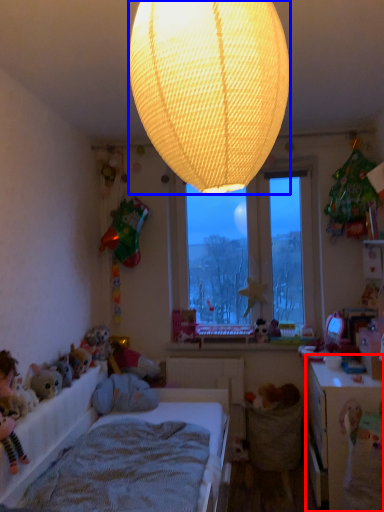
Question: Among these objects, which one is nearest to the camera, table (highlighted by a red box) or lamp (highlighted by a blue box)?

Choices:
 (A) table
 (B) lamp

Answer: (B)